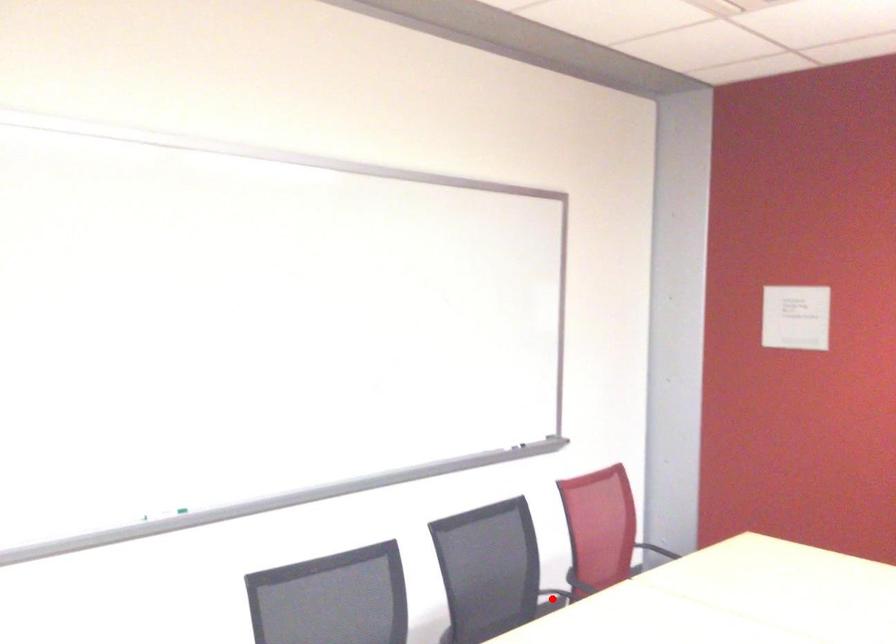
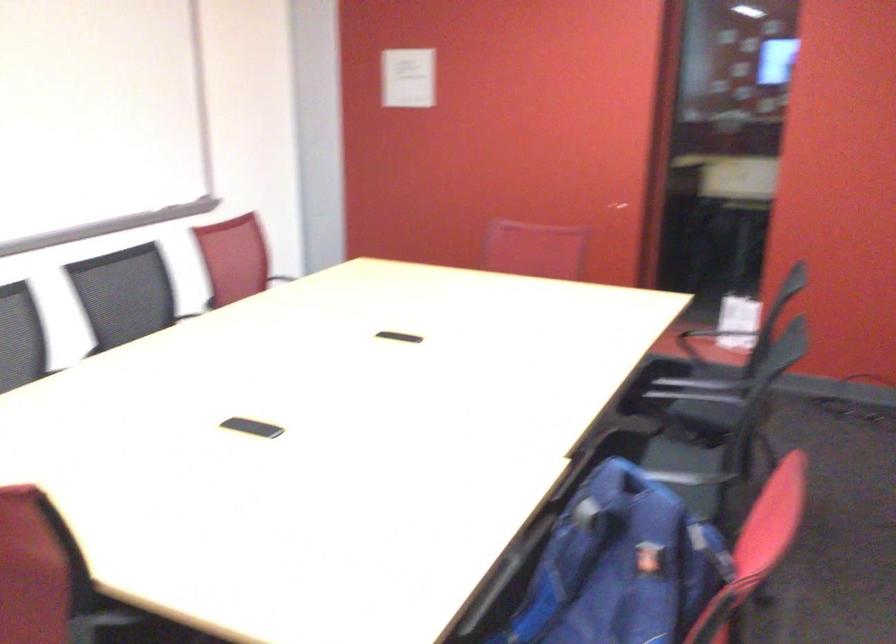
Question: I am providing you with two images of the same scene from different viewpoints. A red point is marked on the first image. Is the red point's position out of view in image 2?

Choices:
 (A) Yes
 (B) No

Answer: (A)